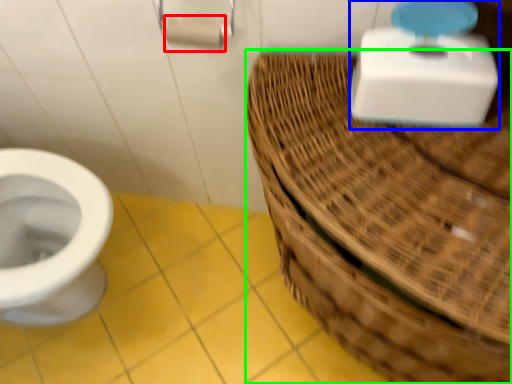
Question: Which object is positioned closest to toilet paper (highlighted by a red box)? Select from scale (highlighted by a blue box) and basket (highlighted by a green box).

Choices:
 (A) scale
 (B) basket

Answer: (A)